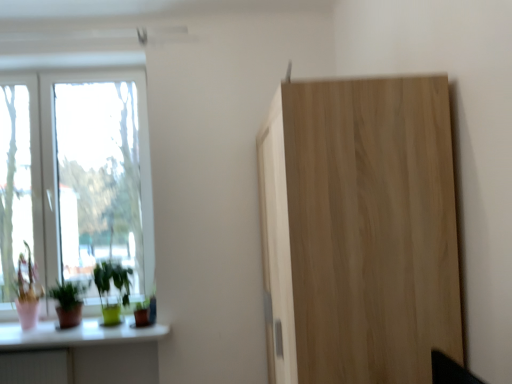
Question: From their relative heights in the image, would you say green matte plant at lower left, the second houseplant positioned from the right, is taller or shorter than transparent glass window at left, marked as the 1th window in a left-to-right arrangement?

Choices:
 (A) tall
 (B) short

Answer: (B)

Question: In the image, is green matte plant at lower left, the second houseplant positioned from the right, positioned in front of or behind transparent glass window at left, the second window viewed from the right?

Choices:
 (A) behind
 (B) front

Answer: (B)

Question: Which object is positioned farthest from the transparent glass window at left, marked as the 1th window in a left-to-right arrangement?

Choices:
 (A) green glossy plant at lower left, acting as the second houseplant starting from the left
 (B) natural wood cupboard at right
 (C) white glass window at left, marked as the 1th window in a right-to-left arrangement
 (D) green matte plant at lower left, the 1th houseplant from the left

Answer: (B)

Question: Which is farther from the transparent glass window at left, marked as the 1th window in a left-to-right arrangement?

Choices:
 (A) natural wood cupboard at right
 (B) green glossy plant at lower left, acting as the second houseplant starting from the left
 (C) white glass window at left, marked as the 1th window in a right-to-left arrangement
 (D) green matte plant at lower left, the second houseplant positioned from the right

Answer: (A)